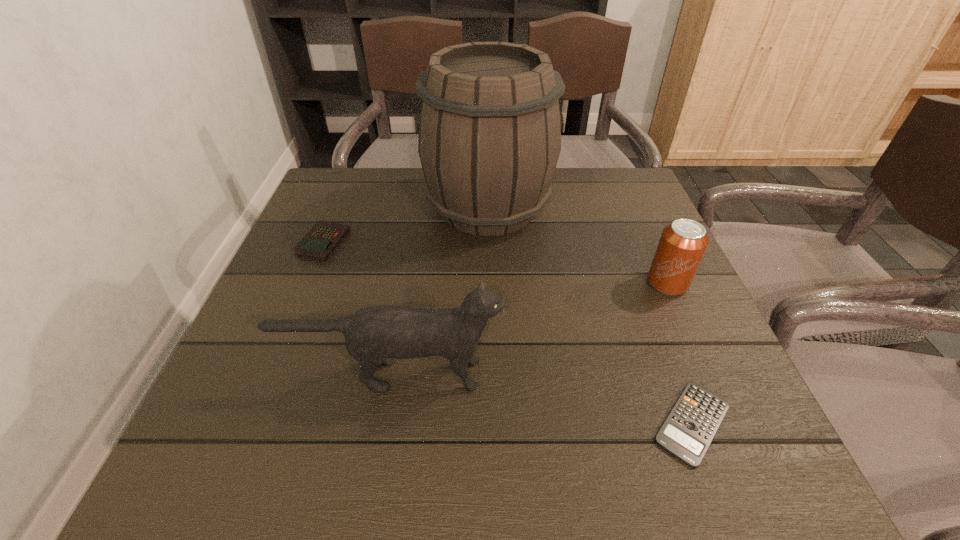
Where is `the tallest object`? Image resolution: width=960 pixels, height=540 pixels. the tallest object is located at coordinates (490, 128).

Identify the location of cat. This screenshot has height=540, width=960. (374, 336).

At what (x,y) coordinates should I click in order to perform the action: click on can. Please return your answer as a coordinate pair (x, y). Looking at the image, I should click on (682, 245).

You are a GUI agent. You are given a task and a screenshot of the screen. Output one action in this format:
    pyautogui.click(x=<x>, y=<y>)
    Task: Click on the third shortest object
    This screenshot has width=960, height=540.
    Given the screenshot: What is the action you would take?
    pyautogui.click(x=682, y=245)

Identify the location of the farther calculator. (318, 244).

Identify the location of the left calculator. The image size is (960, 540). (318, 244).

The height and width of the screenshot is (540, 960). In order to click on the shorter calculator in this screenshot , I will do `click(690, 427)`.

This screenshot has height=540, width=960. I want to click on the nearer calculator, so click(690, 427).

Identify the location of free spot located on the front of the wine bucket. (492, 404).

Where is `free space located on the front-facing side of the second tallest object`? Image resolution: width=960 pixels, height=540 pixels. free space located on the front-facing side of the second tallest object is located at coordinates (650, 374).